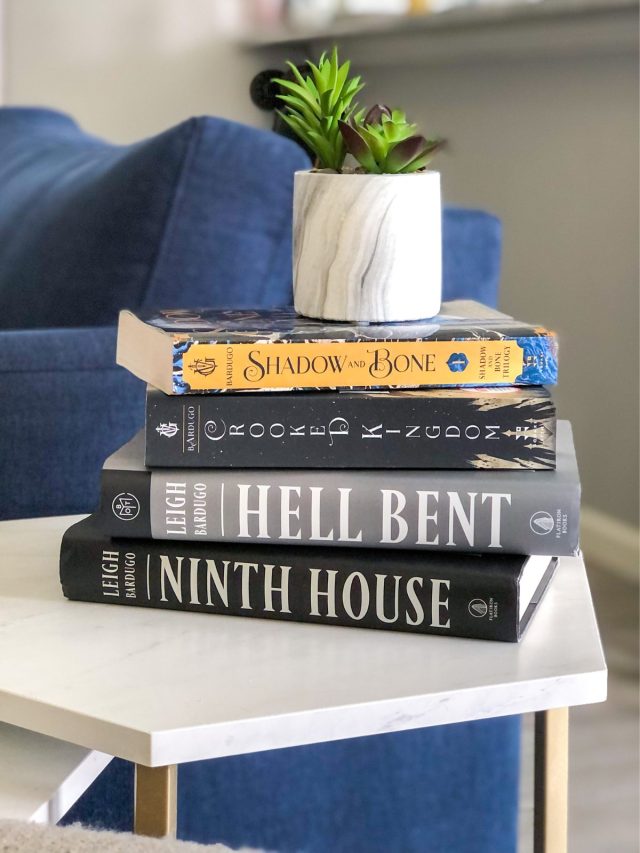
The height and width of the screenshot is (853, 640). What are the coordinates of `potted plant` in the screenshot? It's located at (413, 256).